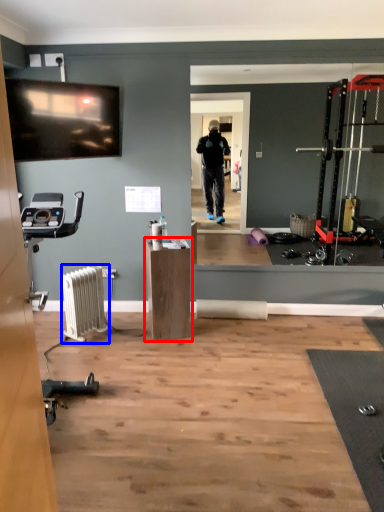
Question: Which of the following is the farthest to the observer, furniture (highlighted by a red box) or radiator (highlighted by a blue box)?

Choices:
 (A) furniture
 (B) radiator

Answer: (A)